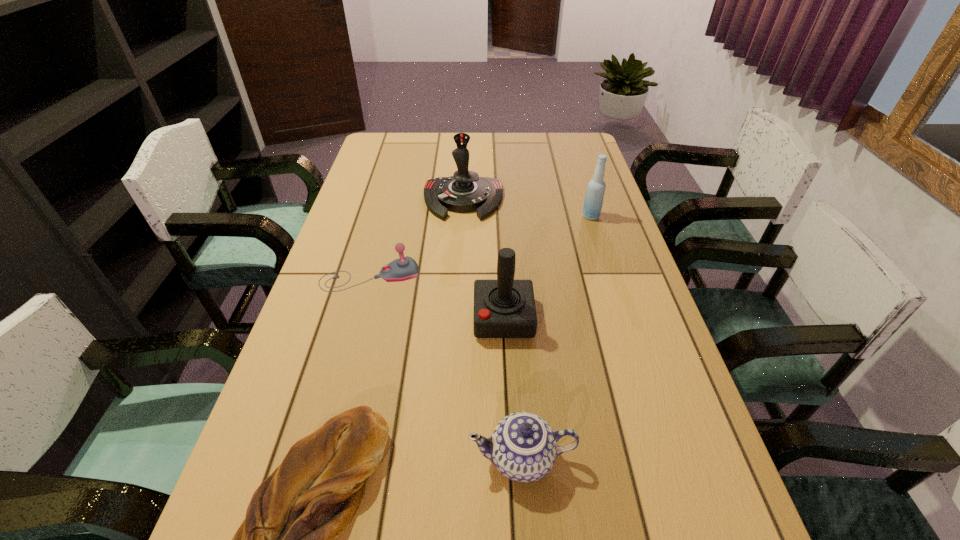
Identify which joystick is the third closest to the bottle. Please provide its 2D coordinates. Your answer should be formatted as a tuple, i.e. [(x, y)], where the tuple contains the x and y coordinates of a point satisfying the conditions above.

[(404, 268)]

Locate which joystick is the second closest to the chinaware. Please provide its 2D coordinates. Your answer should be formatted as a tuple, i.e. [(x, y)], where the tuple contains the x and y coordinates of a point satisfying the conditions above.

[(404, 268)]

At what (x,y) coordinates should I click in order to perform the action: click on free region that satisfies the following two spatial constraints: 1. on the front side of the bottle; 2. on the base of the nearest joystick. Please return your answer as a coordinate pair (x, y). Looking at the image, I should click on (623, 318).

I want to click on free location that satisfies the following two spatial constraints: 1. on the front side of the rightmost object; 2. on the base of the third nearest object, so click(623, 318).